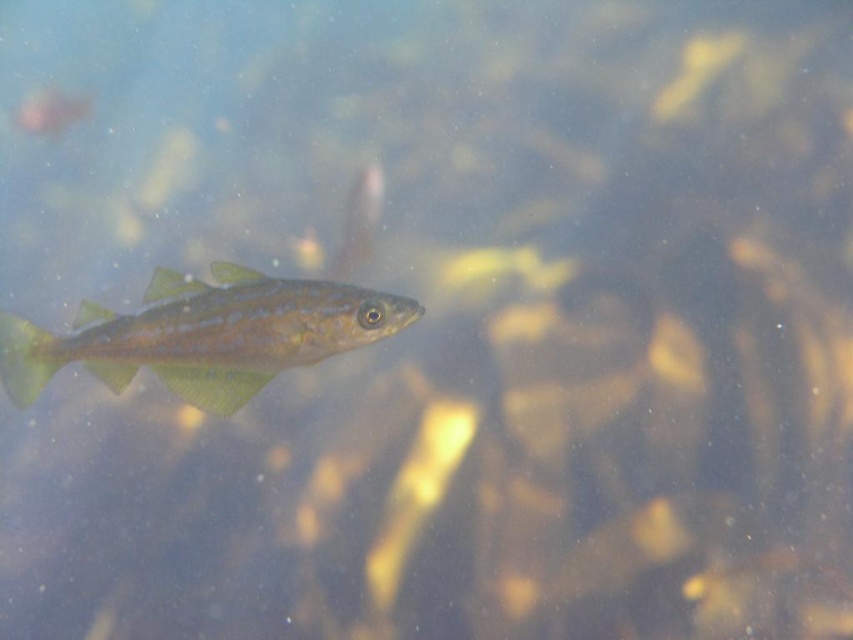
Looking at this image, which is more to the left, translucent yellow-green fish at upper right or translucent greenish-yellow fish at center?

Positioned to the left is translucent greenish-yellow fish at center.

Between point (654, 100) and point (357, 177), which one is positioned behind?

Positioned behind is point (357, 177).

Image resolution: width=853 pixels, height=640 pixels. Identify the location of translucent yellow-green fish at upper right. (695, 70).

Is green translucent fish at center in front of translucent greenish-yellow fish at upper left?

Yes, it is.

Does green translucent fish at center appear on the left side of translucent greenish-yellow fish at upper left?

Incorrect, green translucent fish at center is not on the left side of translucent greenish-yellow fish at upper left.

Looking at this image, who is more distant from viewer, (318,288) or (70,102)?

The point (70,102) is more distant.

Locate an element on the screen. green translucent fish at center is located at coordinates (204, 336).

Is translucent yellow-green fish at upper right positioned at the back of translucent greenish-yellow fish at upper left?

That is False.

Which is above, translucent yellow-green fish at upper right or translucent greenish-yellow fish at upper left?

translucent yellow-green fish at upper right is above.

Locate an element on the screen. Image resolution: width=853 pixels, height=640 pixels. translucent yellow-green fish at upper right is located at coordinates (695, 70).